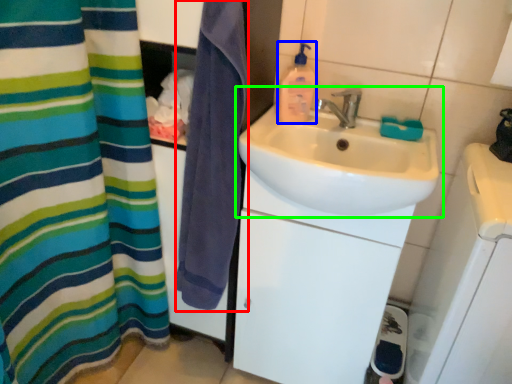
Question: Which object is the closest to the beach towel (highlighted by a red box)? Choose among these: cleaning product (highlighted by a blue box) or sink (highlighted by a green box).

Choices:
 (A) cleaning product
 (B) sink

Answer: (B)